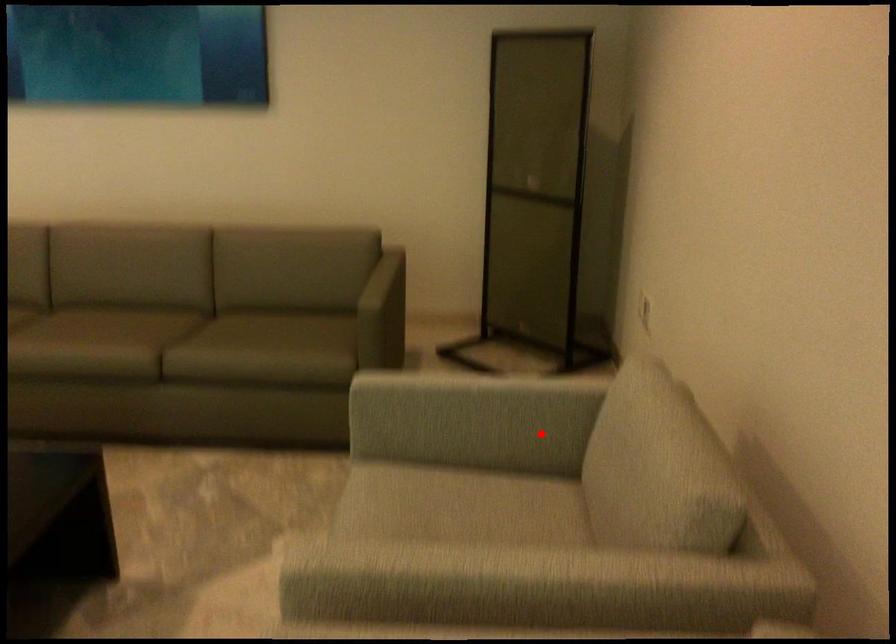
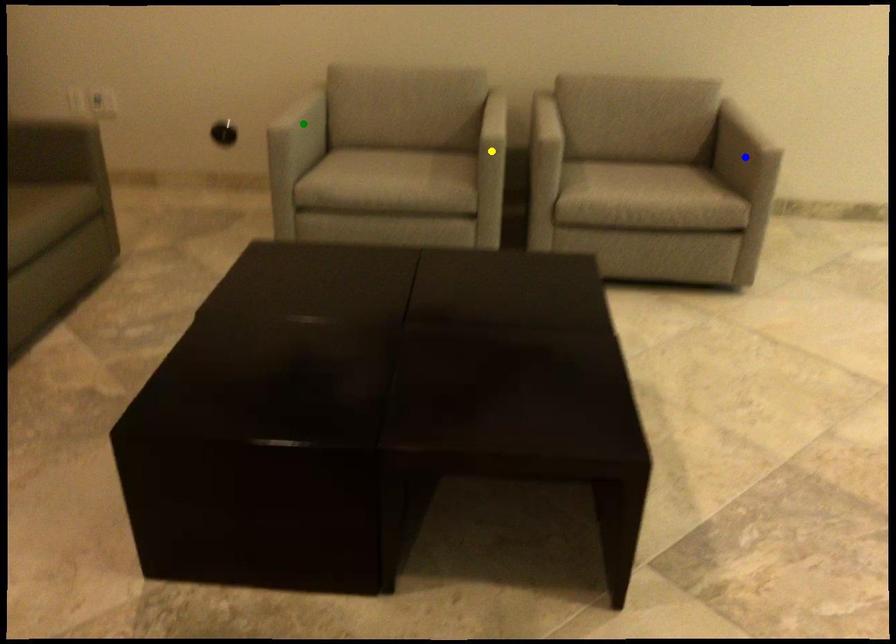
Question: I am providing you with two images of the same scene from different viewpoints. A red point is marked on the first image. You are given multiple points on the second image. Which point in image 2 is actually the same real-world point as the red point in image 1?

Choices:
 (A) blue point
 (B) green point
 (C) yellow point

Answer: (B)